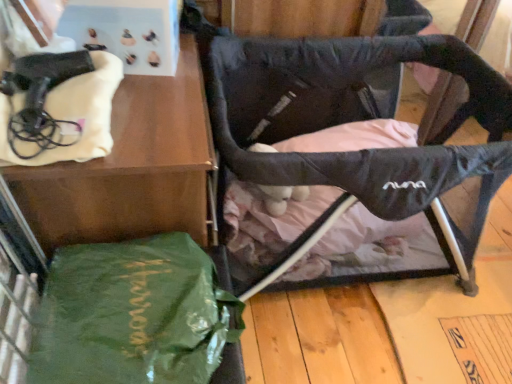
Measure the distance between green shiny tote bag at lower left and camera.

green shiny tote bag at lower left and camera are 31.40 inches apart from each other.

I want to click on green fabric bag at lower left, so click(130, 168).

This screenshot has height=384, width=512. Find the location of `swivel chair below the green shiny tote bag at lower left (from a real-world perspective)`. swivel chair below the green shiny tote bag at lower left (from a real-world perspective) is located at coordinates (352, 148).

From a real-world perspective, which object stands above the other?

green shiny tote bag at lower left is physically above.

Considering the relative sizes of green fabric bag at lower left and black fabric swivel chair at center in the image provided, is green fabric bag at lower left smaller than black fabric swivel chair at center?

Indeed, green fabric bag at lower left has a smaller size compared to black fabric swivel chair at center.

This screenshot has width=512, height=384. In order to click on furniture that is on the left side of black fabric swivel chair at center in this screenshot , I will do `click(130, 168)`.

Is green fabric bag at lower left situated inside black fabric swivel chair at center or outside?

green fabric bag at lower left is not enclosed by black fabric swivel chair at center.

Is green fabric bag at lower left aimed at black fabric swivel chair at center?

Yes, green fabric bag at lower left is aimed at black fabric swivel chair at center.

Would you say green fabric bag at lower left is part of green shiny tote bag at lower left's contents?

Actually, green fabric bag at lower left is outside green shiny tote bag at lower left.

Which of these two, green shiny tote bag at lower left or green fabric bag at lower left, is smaller?

green shiny tote bag at lower left is smaller.

Considering the sizes of green shiny tote bag at lower left and green fabric bag at lower left in the image, is green shiny tote bag at lower left taller or shorter than green fabric bag at lower left?

Clearly, green shiny tote bag at lower left is shorter compared to green fabric bag at lower left.

From a real-world perspective, is green shiny tote bag at lower left located beneath green fabric bag at lower left?

Actually, green shiny tote bag at lower left is physically above green fabric bag at lower left in the real world.

Which object is closer to the camera taking this photo, green fabric bag at lower left or green shiny tote bag at lower left?

Positioned in front is green shiny tote bag at lower left.

Could you tell me if green fabric bag at lower left is facing green shiny tote bag at lower left?

No, green fabric bag at lower left is not aimed at green shiny tote bag at lower left.

Is green shiny tote bag at lower left inside green fabric bag at lower left?

No, green shiny tote bag at lower left is not a part of green fabric bag at lower left.

Is black fabric swivel chair at center not near green shiny tote bag at lower left?

No.

Does black fabric swivel chair at center lie behind green shiny tote bag at lower left?

Yes, it is behind green shiny tote bag at lower left.

From a real-world perspective, is black fabric swivel chair at center on top of green shiny tote bag at lower left?

No, from a real-world perspective, black fabric swivel chair at center is not on top of green shiny tote bag at lower left.

Is point (291, 136) positioned after point (195, 113)?

Yes, it is behind point (195, 113).

Considering the sizes of black fabric swivel chair at center and green fabric bag at lower left in the image, is black fabric swivel chair at center taller or shorter than green fabric bag at lower left?

Considering their sizes, black fabric swivel chair at center has less height than green fabric bag at lower left.

Measure the distance from black fabric swivel chair at center to green fabric bag at lower left.

The distance of black fabric swivel chair at center from green fabric bag at lower left is 18.44 inches.

Considering the sizes of objects black fabric swivel chair at center and green fabric bag at lower left in the image provided, who is wider, black fabric swivel chair at center or green fabric bag at lower left?

Wider between the two is black fabric swivel chair at center.

Where is `swivel chair located underneath the green shiny tote bag at lower left (from a real-world perspective)`? The height and width of the screenshot is (384, 512). swivel chair located underneath the green shiny tote bag at lower left (from a real-world perspective) is located at coordinates (352, 148).

In the image, there is a black fabric swivel chair at center. Identify the location of furniture below it (from the image's perspective). The width and height of the screenshot is (512, 384). (130, 168).

From the image, which object appears to be farther from black fabric swivel chair at center, green shiny tote bag at lower left or green fabric bag at lower left?

Based on the image, green shiny tote bag at lower left appears to be further to black fabric swivel chair at center.

Which object lies nearer to the anchor point green shiny tote bag at lower left, green fabric bag at lower left or black fabric swivel chair at center?

Among the two, green fabric bag at lower left is located nearer to green shiny tote bag at lower left.

From the image, which object appears to be farther from black fabric swivel chair at center, green fabric bag at lower left or green shiny tote bag at lower left?

Based on the image, green shiny tote bag at lower left appears to be further to black fabric swivel chair at center.

From the image, which object appears to be farther from green fabric bag at lower left, black fabric swivel chair at center or green shiny tote bag at lower left?

black fabric swivel chair at center.

Considering their positions, is green shiny tote bag at lower left positioned closer to green fabric bag at lower left than black fabric swivel chair at center?

The object closer to green fabric bag at lower left is green shiny tote bag at lower left.

Estimate the real-world distances between objects in this image. Which object is further from green shiny tote bag at lower left, black fabric swivel chair at center or green fabric bag at lower left?

black fabric swivel chair at center is positioned further to the anchor green shiny tote bag at lower left.

Find the location of a particular element. tote bag between green fabric bag at lower left and black fabric swivel chair at center from left to right is located at coordinates (132, 315).